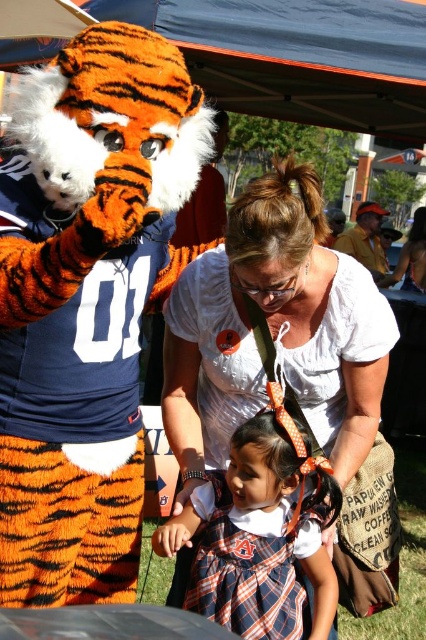
Which of these two, white cotton shirt at center or plaid fabric dress at center, stands taller?

white cotton shirt at center

Between point (363, 340) and point (164, 552), which one is positioned in front?

Point (164, 552) is more forward.

This screenshot has height=640, width=426. Find the location of `white cotton shirt at center`. white cotton shirt at center is located at coordinates (273, 332).